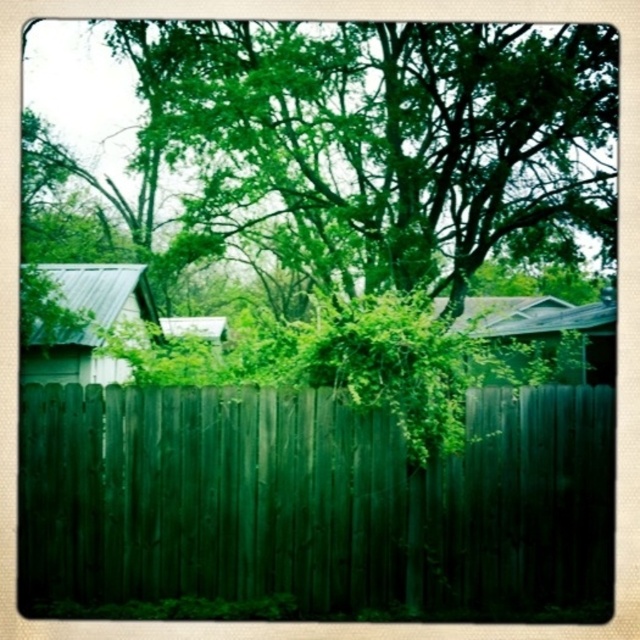
Question: Can you confirm if metallic green hut at left is positioned to the left of wooden shed at center?

Choices:
 (A) yes
 (B) no

Answer: (A)

Question: Among these points, which one is farthest from the camera?

Choices:
 (A) (588, 355)
 (B) (26, 349)
 (C) (433, 545)

Answer: (A)

Question: Which is nearer to the dark green wood fence at center?

Choices:
 (A) metallic green hut at left
 (B) wooden shed at center

Answer: (A)

Question: Is dark green wood fence at center to the right of metallic green hut at left from the viewer's perspective?

Choices:
 (A) no
 (B) yes

Answer: (B)

Question: Which object appears farthest from the camera in this image?

Choices:
 (A) metallic green hut at left
 (B) wooden shed at center

Answer: (A)

Question: Does dark green wood fence at center appear under metallic green hut at left?

Choices:
 (A) yes
 (B) no

Answer: (A)